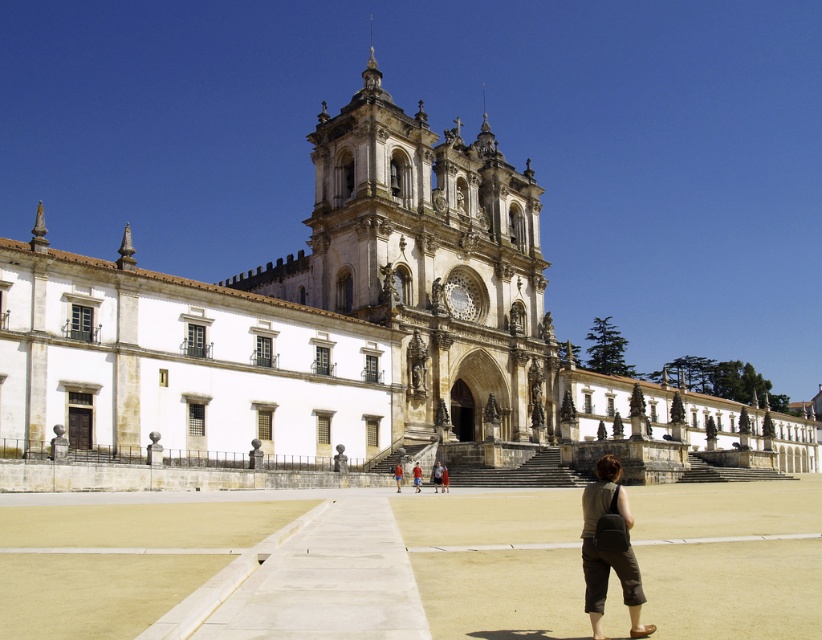
Question: Can you confirm if white stone tower at center is positioned to the right of red shirt at center?

Choices:
 (A) yes
 (B) no

Answer: (B)

Question: Which point is farther from the camera taking this photo?

Choices:
 (A) (433, 244)
 (B) (615, 556)

Answer: (A)

Question: Which point is farther from the camera taking this photo?

Choices:
 (A) (400, 474)
 (B) (444, 492)
 (C) (590, 540)
 (D) (416, 484)

Answer: (D)

Question: Which point is farther from the camera taking this photo?

Choices:
 (A) (442, 467)
 (B) (617, 531)

Answer: (A)

Question: Is brown fabric pants at lower right thinner than red shirt at center?

Choices:
 (A) yes
 (B) no

Answer: (B)

Question: Is white stone church at center bigger than white stone tower at center?

Choices:
 (A) yes
 (B) no

Answer: (A)